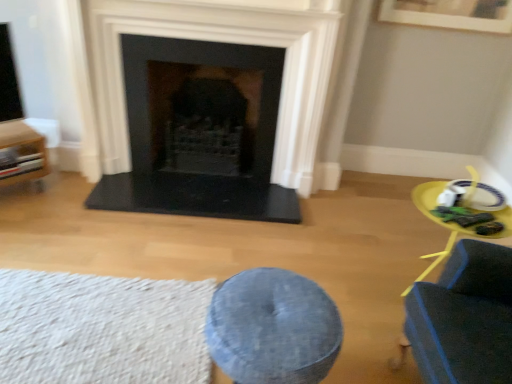
At what (x,y) coordinates should I click in order to perform the action: click on vacant space to the right of wooden cabinet at left. Please return your answer as a coordinate pair (x, y). This screenshot has height=384, width=512. Looking at the image, I should click on (54, 200).